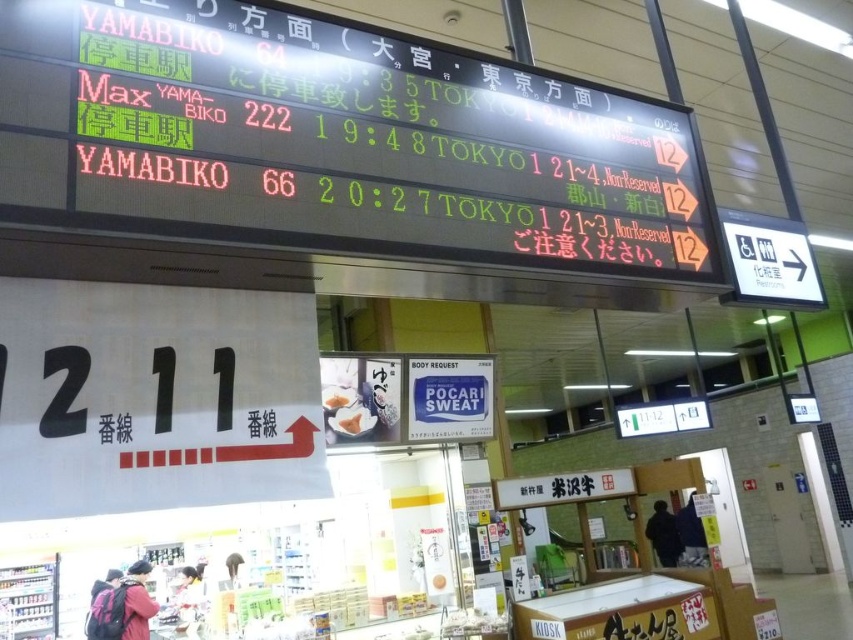
This screenshot has width=853, height=640. Describe the element at coordinates (398, 132) in the screenshot. I see `led electronic board at upper center` at that location.

Is point (383, 205) in front of point (343, 419)?

Yes.

Does point (140, 58) come behind point (358, 419)?

That is False.

Identify the location of led electronic board at upper center. This screenshot has width=853, height=640. (398, 132).

Between point (355, 80) and point (329, 403), which one is positioned in front?

Point (355, 80)

Measure the distance between led electronic board at upper center and camera.

1.61 meters

You are a GUI agent. You are given a task and a screenshot of the screen. Output one action in this format:
    pyautogui.click(x=<x>, y=<y>)
    Task: Click on the led electronic board at upper center
    This screenshot has height=640, width=853.
    Given the screenshot: What is the action you would take?
    pyautogui.click(x=398, y=132)

Who is higher up, white matte bread at center or white paper bag at center?

white paper bag at center is higher up.

Find the location of `white matte bread at center`. white matte bread at center is located at coordinates (350, 420).

Does point (339, 420) come farther from viewer compared to point (343, 403)?

No.

This screenshot has width=853, height=640. In order to click on white matte bread at center in this screenshot , I will do `click(350, 420)`.